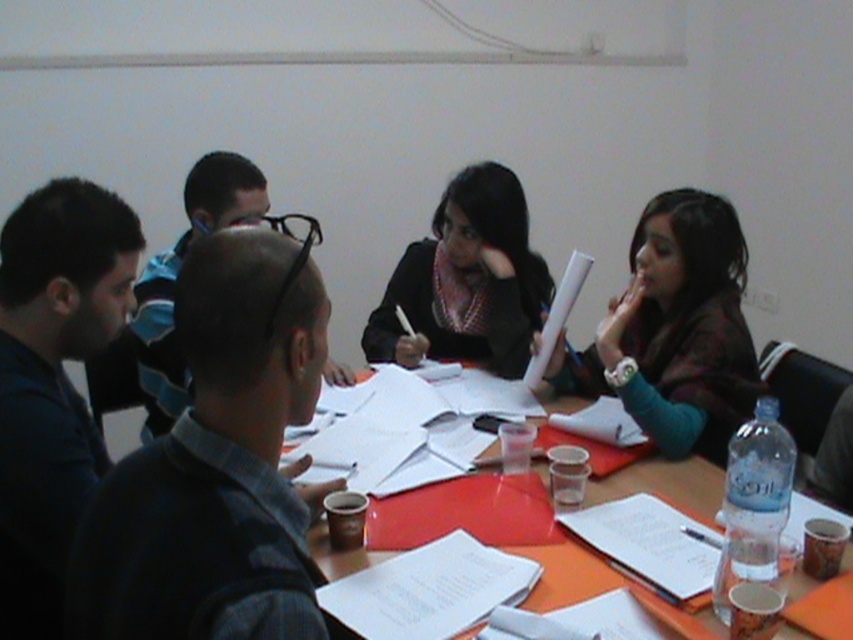
You are standing at the front of the room and looking at the table. There are two points on the table labeled as point [590,365] and point [463,214]. Which point is closer to you?

Point [463,214] is closer to you because it is nearer to the camera compared to point [590,365], which is further away.

You are standing in the room and want to pick up the matte brown jacket at upper right. To reach it, you need to walk around the wooden table at center. Which direction should you walk to avoid the table?

Since the matte brown jacket at upper right is closer to you than the wooden table at center, you can reach it without needing to go around the table. Simply extend your arm towards the jacket.